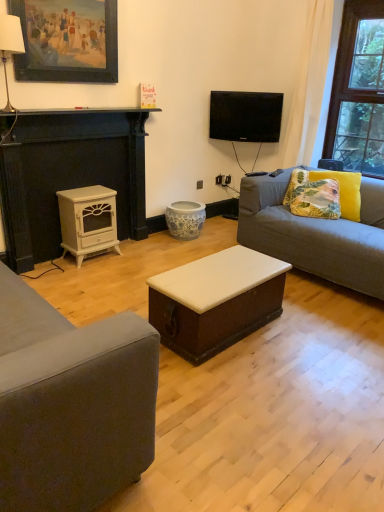
Question: Can you confirm if white painted wood trunk at center, marked as the 2th table in a back-to-front arrangement, is positioned to the left of wooden picture frame at upper left?

Choices:
 (A) no
 (B) yes

Answer: (A)

Question: Can you confirm if white painted wood trunk at center, which is counted as the 1th table, starting from the bottom, is smaller than wooden picture frame at upper left?

Choices:
 (A) yes
 (B) no

Answer: (B)

Question: Does white painted wood trunk at center, which is counted as the 1th table, starting from the bottom, have a larger size compared to wooden picture frame at upper left?

Choices:
 (A) yes
 (B) no

Answer: (A)

Question: Is white painted wood trunk at center, marked as the first table in a front-to-back arrangement, surrounding wooden picture frame at upper left?

Choices:
 (A) yes
 (B) no

Answer: (B)

Question: Is white painted wood trunk at center, which appears as the 2th table when viewed from the left, to the right of wooden picture frame at upper left from the viewer's perspective?

Choices:
 (A) no
 (B) yes

Answer: (B)

Question: Is wooden picture frame at upper left situated inside gray fabric couch at right or outside?

Choices:
 (A) inside
 (B) outside

Answer: (B)

Question: Visually, is wooden picture frame at upper left positioned to the left or to the right of gray fabric couch at right?

Choices:
 (A) right
 (B) left

Answer: (B)

Question: Considering the positions of point (69, 29) and point (372, 248), is point (69, 29) closer or farther from the camera than point (372, 248)?

Choices:
 (A) closer
 (B) farther

Answer: (B)

Question: Based on their sizes in the image, would you say wooden picture frame at upper left is bigger or smaller than gray fabric couch at right?

Choices:
 (A) small
 (B) big

Answer: (A)

Question: Looking at their shapes, would you say gray fabric couch at right is wider or thinner than white painted wood stove at left, the 2th table in the front-to-back sequence?

Choices:
 (A) wide
 (B) thin

Answer: (A)

Question: Relative to white painted wood stove at left, which is counted as the 1th table, starting from the left, is gray fabric couch at right in front or behind?

Choices:
 (A) behind
 (B) front

Answer: (B)

Question: Based on their positions, is gray fabric couch at right located to the left or right of white painted wood stove at left, placed as the 2th table when sorted from right to left?

Choices:
 (A) left
 (B) right

Answer: (B)

Question: From a real-world perspective, relative to white painted wood stove at left, which is counted as the first table, starting from the back, is gray fabric couch at right vertically above or below?

Choices:
 (A) above
 (B) below

Answer: (A)

Question: Looking at their shapes, would you say floral fabric cushion at right, which ranks as the 1th pillow in right-to-left order, is wider or thinner than white painted wood stove at left, which is counted as the first table, starting from the back?

Choices:
 (A) wide
 (B) thin

Answer: (B)

Question: From a real-world perspective, is floral fabric cushion at right, which ranks as the 1th pillow in right-to-left order, physically located above or below white painted wood stove at left, placed as the 2th table when sorted from right to left?

Choices:
 (A) above
 (B) below

Answer: (A)